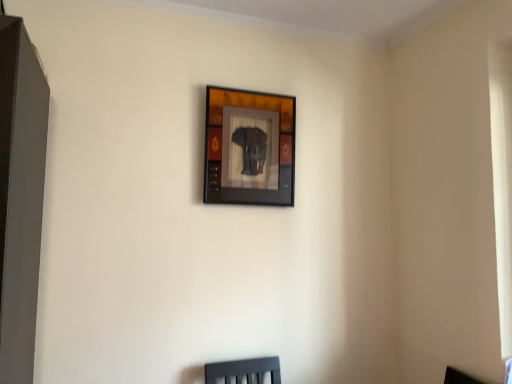
The height and width of the screenshot is (384, 512). Describe the element at coordinates (249, 147) in the screenshot. I see `wooden elephant artwork at upper center` at that location.

You are a GUI agent. You are given a task and a screenshot of the screen. Output one action in this format:
    pyautogui.click(x=<x>, y=<y>)
    Task: Click on the wooden elephant artwork at upper center
    This screenshot has width=512, height=384.
    Given the screenshot: What is the action you would take?
    pyautogui.click(x=249, y=147)

You are a GUI agent. You are given a task and a screenshot of the screen. Output one action in this format:
    pyautogui.click(x=<x>, y=<y>)
    Task: Click on the wooden elephant artwork at upper center
    The image size is (512, 384).
    Given the screenshot: What is the action you would take?
    pyautogui.click(x=249, y=147)